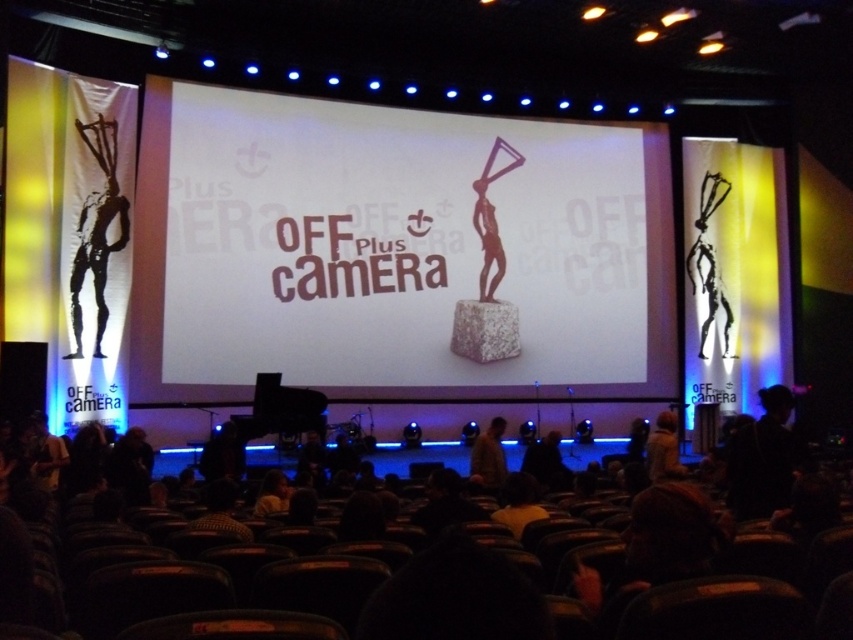
You are standing at the center of the stage facing the audience. You want to move to the silvery metallic statue at left. In which direction should you turn?

You should turn to your left since the silvery metallic statue at left is located at point (x=97, y=230), which is to the left side of the stage.

You are an event coordinator arranging the stage for the presentation. You need to ensure that the silvery metallic statue at left and the matte bronze statue at center are positioned so that the audience can see both clearly. Based on their current positions, which statue is closer to the audience and might block the view of the other?

The silvery metallic statue at left is in front of the matte bronze statue at center, so it is closer to the audience and might block their view of the matte bronze statue at center.